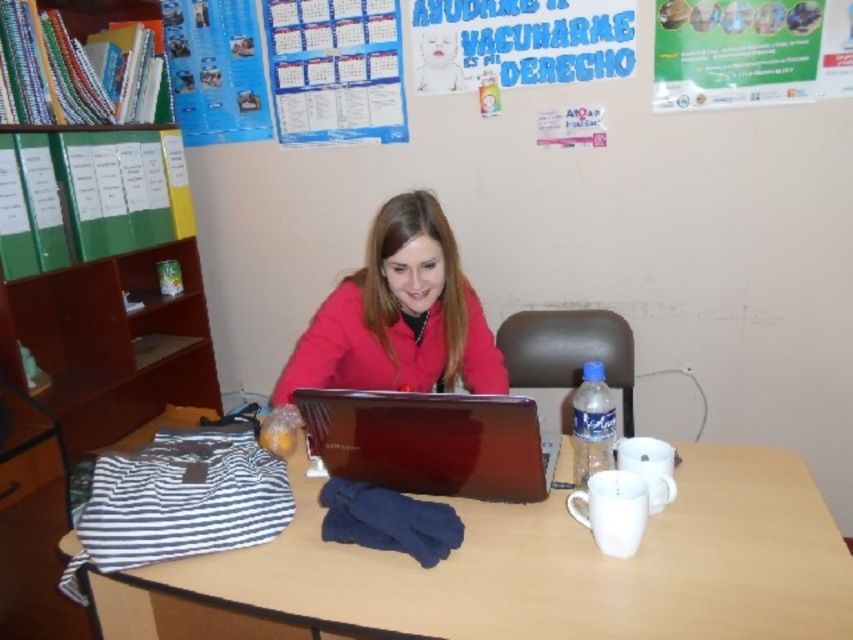
Is point (122, 182) positioned in front of point (283, 96)?

Yes.

Is green file folders at left taller than matte paper calendar at upper center?

Correct, green file folders at left is much taller as matte paper calendar at upper center.

Who is more distant from viewer, (132, 196) or (352, 97)?

Positioned behind is point (352, 97).

You are a GUI agent. You are given a task and a screenshot of the screen. Output one action in this format:
    pyautogui.click(x=<x>, y=<y>)
    Task: Click on the green file folders at left
    This screenshot has height=640, width=853.
    Given the screenshot: What is the action you would take?
    pyautogui.click(x=90, y=195)

Is point (705, 593) positioned in front of point (804, 45)?

Yes, it is in front of point (804, 45).

Looking at this image, does wooden table at center have a larger size compared to matte green poster at upper right?

Yes, wooden table at center is bigger than matte green poster at upper right.

Is point (125, 440) closer to viewer compared to point (693, 26)?

No, it is not.

Image resolution: width=853 pixels, height=640 pixels. What are the coordinates of `wooden table at center` in the screenshot? It's located at (526, 572).

Who is lower down, wooden table at center or matte red jacket at center?

wooden table at center is below.

Where is `wooden table at center`? wooden table at center is located at coordinates (526, 572).

Where is `wooden table at center`? The width and height of the screenshot is (853, 640). wooden table at center is located at coordinates (526, 572).